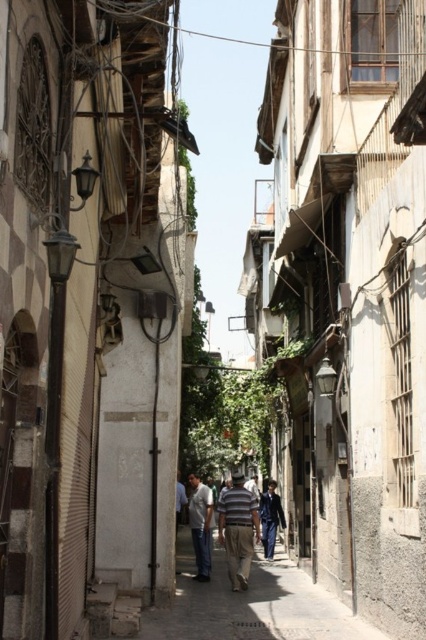
You are standing in the alleyway and need to pick up both the striped cotton shirt at center and the light blue jeans at center. Which item should you reach for first to avoid bending down too much?

The striped cotton shirt at center is closer to the viewer than the light blue jeans at center, so you should reach for the striped cotton shirt at center first to avoid bending down too much.

You are a delivery person carrying a package that requires a clear path to the entrance of the alleyway. You notice the striped cotton shirt at center hanging from a clothesline. Is there enough space between the shirt and the electrical wires above to safely pass through without touching anything?

The striped cotton shirt at center is located at point (238, 531). Since the shirt is hanging from a clothesline, there is sufficient vertical space between it and the electrical wires overhead to allow safe passage for the delivery person and their package.

You are a delivery person in a narrow alleyway. You need to deliver a package to a customer standing near the striped cotton shirt at center and the light blue jeans at center. Since the alley is narrow, you must determine which item is closer to the ground to avoid hitting the overhead wires. Which item is lower?

The striped cotton shirt at center is positioned under light blue jeans at center, so the striped cotton shirt at center is lower to the ground and closer to the delivery person. To avoid hitting the overhead wires, the delivery person should aim for the striped cotton shirt at center as it is lower.